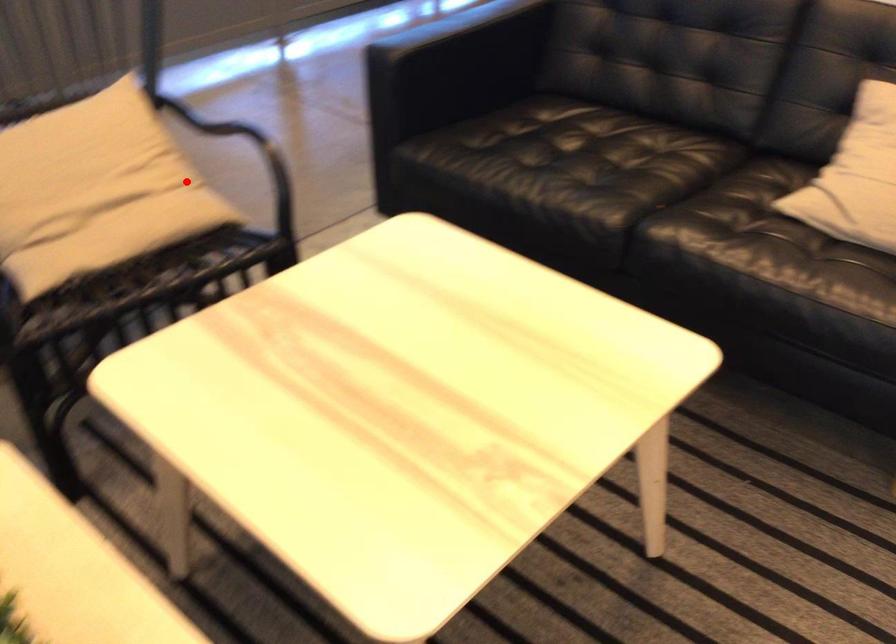
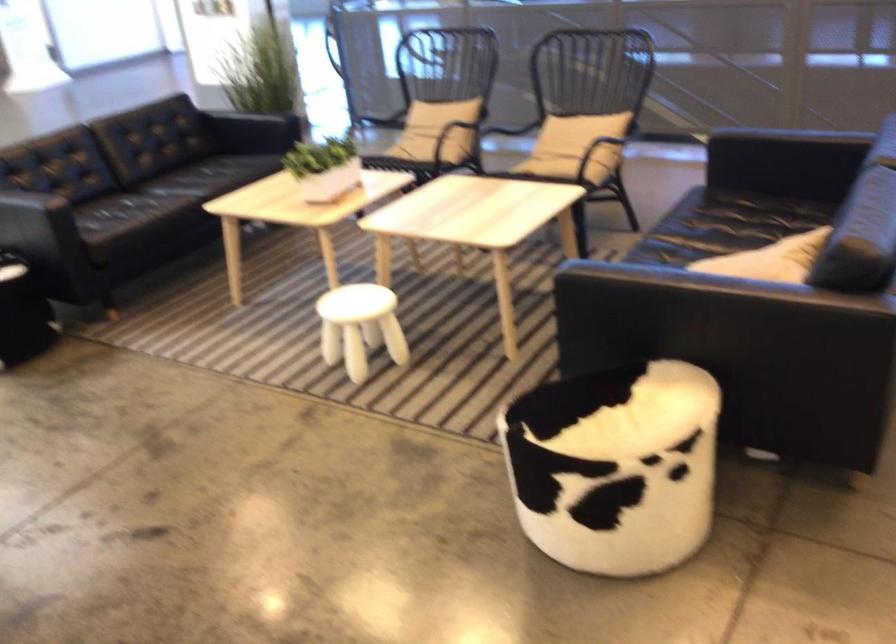
In the second image, find the point that corresponds to the highlighted location in the first image.

(574, 147)